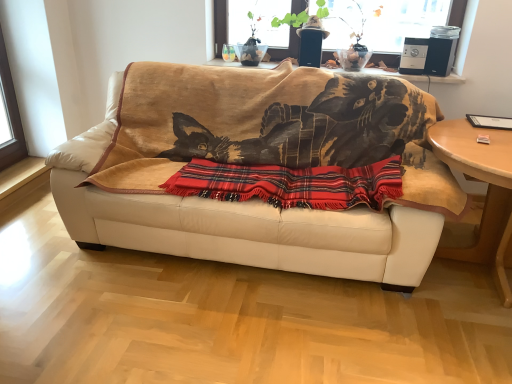
Question: From a real-world perspective, is wooden round table at right on red plaid blanket at center?

Choices:
 (A) yes
 (B) no

Answer: (B)

Question: From a real-world perspective, does wooden round table at right sit lower than red plaid blanket at center?

Choices:
 (A) no
 (B) yes

Answer: (B)

Question: Is wooden round table at right further to camera compared to red plaid blanket at center?

Choices:
 (A) yes
 (B) no

Answer: (B)

Question: Can you confirm if wooden round table at right is bigger than red plaid blanket at center?

Choices:
 (A) yes
 (B) no

Answer: (A)

Question: Considering the relative positions of wooden round table at right and red plaid blanket at center in the image provided, is wooden round table at right to the left of red plaid blanket at center from the viewer's perspective?

Choices:
 (A) no
 (B) yes

Answer: (A)

Question: Is wooden round table at right outside red plaid blanket at center?

Choices:
 (A) no
 (B) yes

Answer: (B)

Question: Does smooth glass window sill at upper center have a greater width compared to red plaid blanket at center?

Choices:
 (A) no
 (B) yes

Answer: (A)

Question: Is smooth glass window sill at upper center not within red plaid blanket at center?

Choices:
 (A) yes
 (B) no

Answer: (A)

Question: Is smooth glass window sill at upper center oriented towards red plaid blanket at center?

Choices:
 (A) yes
 (B) no

Answer: (B)

Question: From the image's perspective, would you say smooth glass window sill at upper center is positioned over red plaid blanket at center?

Choices:
 (A) yes
 (B) no

Answer: (A)

Question: From the image's perspective, is smooth glass window sill at upper center located beneath red plaid blanket at center?

Choices:
 (A) no
 (B) yes

Answer: (A)

Question: Does smooth glass window sill at upper center have a lesser width compared to red plaid blanket at center?

Choices:
 (A) yes
 (B) no

Answer: (A)

Question: Is leather couch at center further to the viewer compared to wooden round table at right?

Choices:
 (A) no
 (B) yes

Answer: (A)